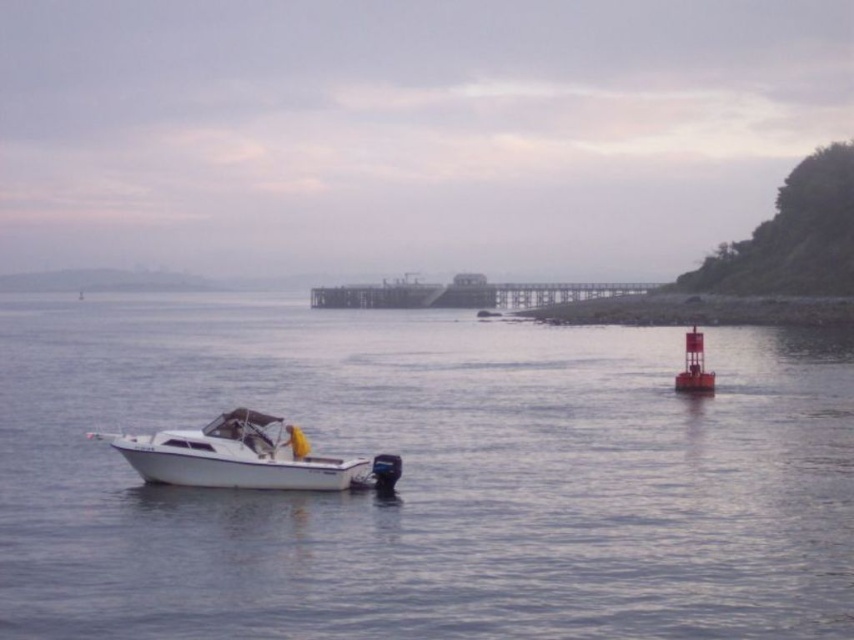
Question: Considering the real-world distances, which object is closest to the wooden pier at center?

Choices:
 (A) white smooth water at center
 (B) white glossy boat at lower left

Answer: (A)

Question: Among these objects, which one is nearest to the camera?

Choices:
 (A) white smooth water at center
 (B) white glossy boat at lower left

Answer: (A)

Question: Can you confirm if white glossy boat at lower left is positioned to the right of wooden pier at center?

Choices:
 (A) no
 (B) yes

Answer: (A)

Question: Among these points, which one is farthest from the camera?

Choices:
 (A) (313, 464)
 (B) (369, 305)
 (C) (797, 598)

Answer: (B)

Question: Observing the image, what is the correct spatial positioning of white smooth water at center in reference to white glossy boat at lower left?

Choices:
 (A) right
 (B) left

Answer: (B)

Question: From the image, what is the correct spatial relationship of white smooth water at center in relation to white glossy boat at lower left?

Choices:
 (A) above
 (B) below

Answer: (A)